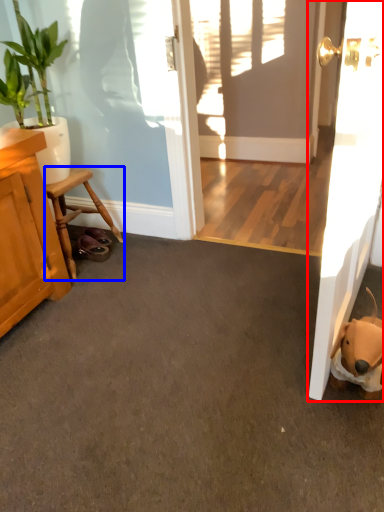
Question: Among these objects, which one is farthest to the camera, door (highlighted by a red box) or furniture (highlighted by a blue box)?

Choices:
 (A) door
 (B) furniture

Answer: (B)